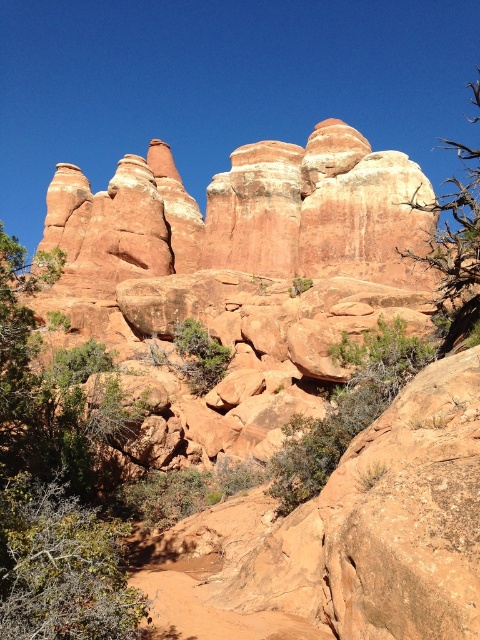
Does rustic sandstone rock formation at center have a lesser width compared to green leafy shrub at left?

No, rustic sandstone rock formation at center is not thinner than green leafy shrub at left.

Does rustic sandstone rock formation at center appear over green leafy shrub at left?

Correct, rustic sandstone rock formation at center is located above green leafy shrub at left.

In the scene shown: Who is more forward, (320, 148) or (1, 474)?

Point (1, 474) is more forward.

You are a GUI agent. You are given a task and a screenshot of the screen. Output one action in this format:
    pyautogui.click(x=<x>, y=<y>)
    Task: Click on the rustic sandstone rock formation at center
    
    Given the screenshot: What is the action you would take?
    pyautogui.click(x=218, y=296)

Which of these two, green leafy bush at lower left or brown textured tree at right, stands taller?

Standing taller between the two is brown textured tree at right.

Is green leafy bush at lower left positioned in front of brown textured tree at right?

Yes, green leafy bush at lower left is closer to the viewer.

Where is `green leafy bush at lower left`? This screenshot has height=640, width=480. green leafy bush at lower left is located at coordinates (61, 566).

Where is `green leafy bush at lower left`? This screenshot has height=640, width=480. green leafy bush at lower left is located at coordinates (61, 566).

Can you confirm if green leafy bush at lower left is shorter than green leafy shrub at center?

Correct, green leafy bush at lower left is not as tall as green leafy shrub at center.

Who is more forward, (33,628) or (275,484)?

Point (33,628) is more forward.

You are a GUI agent. You are given a task and a screenshot of the screen. Output one action in this format:
    pyautogui.click(x=<x>, y=<y>)
    Task: Click on the green leafy bush at lower left
    This screenshot has height=640, width=480.
    Given the screenshot: What is the action you would take?
    pyautogui.click(x=61, y=566)